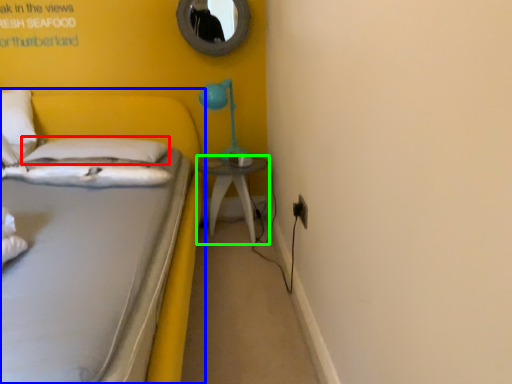
Question: Estimate the real-world distances between objects in this image. Which object is closer to pillow (highlighted by a red box), bed (highlighted by a blue box) or nightstand (highlighted by a green box)?

Choices:
 (A) bed
 (B) nightstand

Answer: (A)